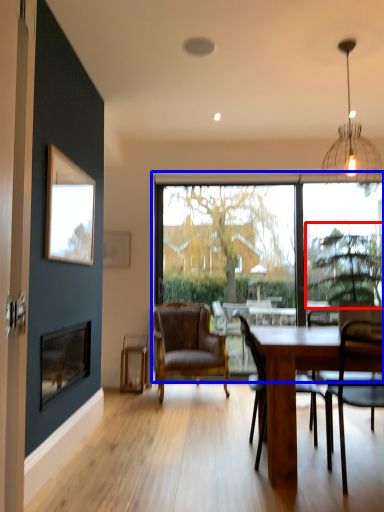
Question: Which object appears closest to the camera in this image, tree (highlighted by a red box) or window (highlighted by a blue box)?

Choices:
 (A) tree
 (B) window

Answer: (A)